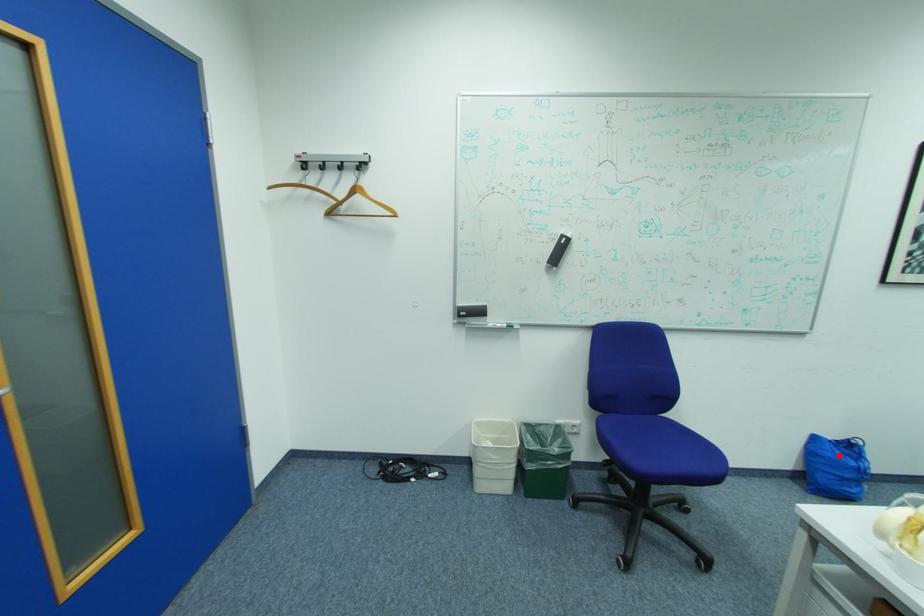
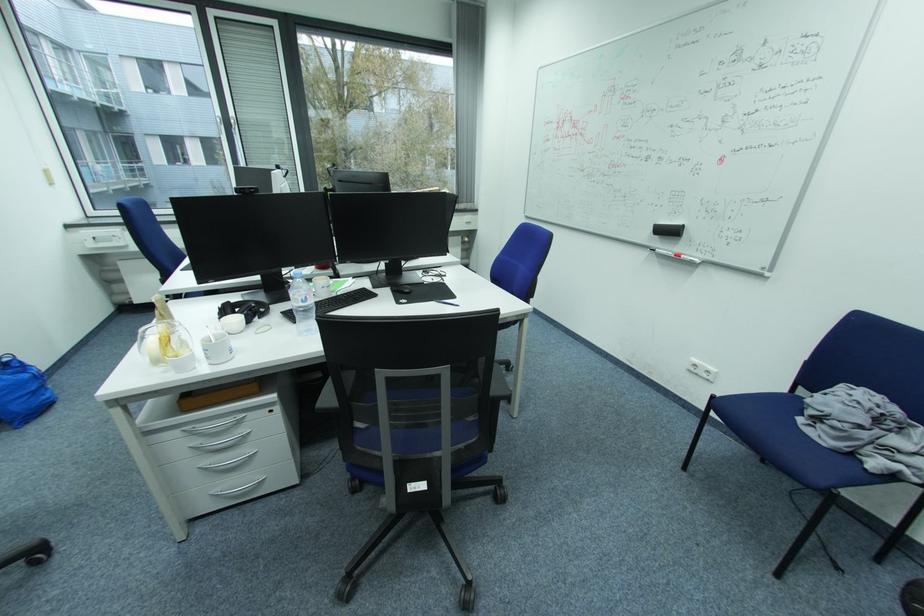
The point at the highlighted location is marked in the first image. Where is the corresponding point in the second image?

(9, 385)